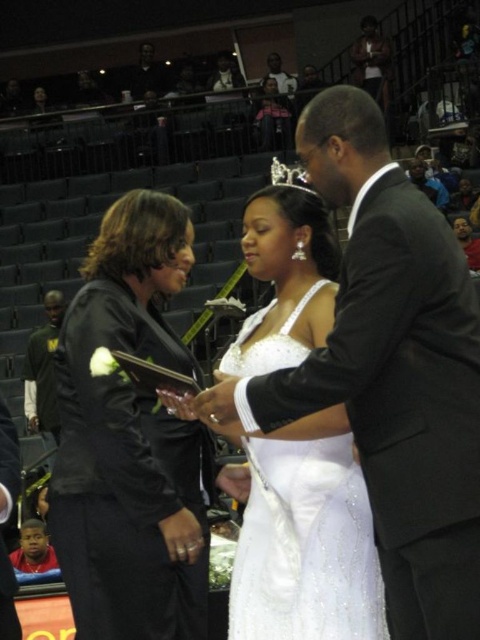
You are a photographer at the wedding and need to adjust your camera settings to capture both the black satin jacket at left and the silver metallic tiara at center clearly. Based on their positions, which object should you focus on first to ensure proper depth of field?

The black satin jacket at left is below the silver metallic tiara at center, so you should focus on the silver metallic tiara at center first since it is closer to the camera. This will ensure the jacket in the background remains in acceptable focus.

You are a photographer at the wedding and need to position a spotlight on the black satin jacket at left and the silver metallic tiara at center. Since the spotlight can only cover one object at a time, which object should you aim it at first to ensure the closest one is illuminated first?

The silver metallic tiara at center is closer to the photographer than the black satin jacket at left, so you should aim the spotlight at the silver metallic tiara at center first.

You are a photographer at a wedding. You need to capture a photo of the white satin dress at center and the dark green jersey at left. Based on their sizes, which one should you focus on first to ensure they both fit in the frame?

The white satin dress at center has a lesser width compared to the dark green jersey at left, so you should focus on the dark green jersey at left first to ensure both fit in the frame.